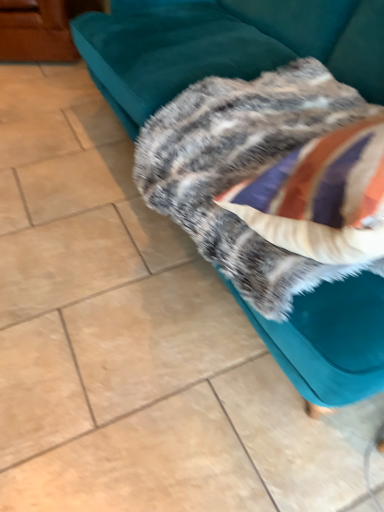
You are a GUI agent. You are given a task and a screenshot of the screen. Output one action in this format:
    pyautogui.click(x=<x>, y=<y>)
    Task: Click on the velvet teal couch at upper right
    The width and height of the screenshot is (384, 512).
    Given the screenshot: What is the action you would take?
    pyautogui.click(x=224, y=46)

This screenshot has height=512, width=384. Describe the element at coordinates (224, 46) in the screenshot. I see `velvet teal couch at upper right` at that location.

The height and width of the screenshot is (512, 384). I want to click on velvet teal couch at upper right, so click(x=224, y=46).